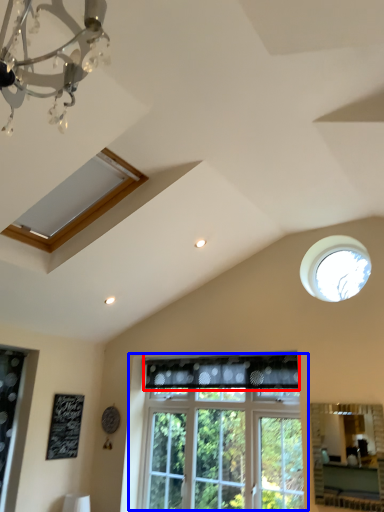
Question: Which object is closer to the camera taking this photo, curtain (highlighted by a red box) or window (highlighted by a blue box)?

Choices:
 (A) curtain
 (B) window

Answer: (B)